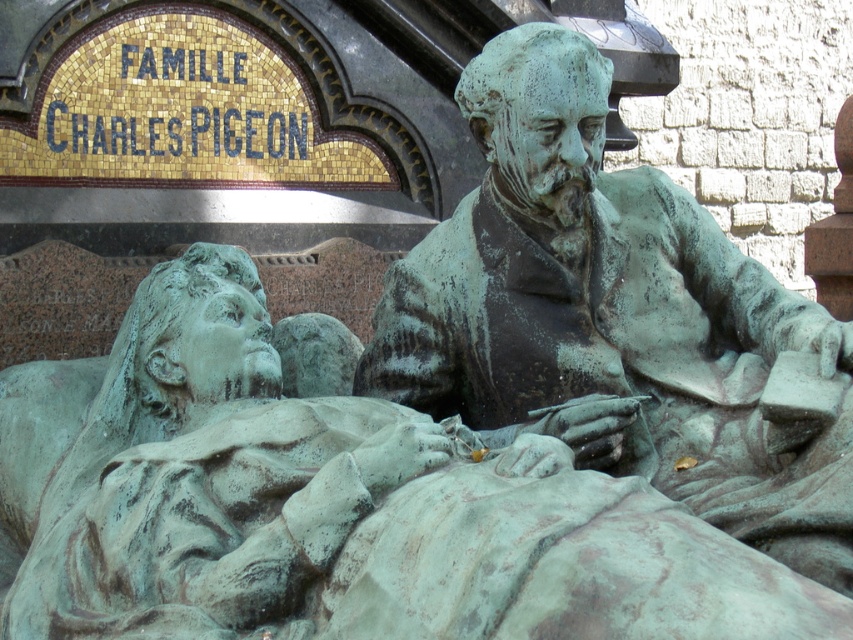
You are a tourist standing in front of the bronze sculpture. You notice a point marked at coordinates (329, 506). Based on the scene description, what object is located at that point?

The point at coordinates (329, 506) indicates the green patinated bronze statue at upper center.

You are an art conservator assessing the spacing between two green patinated bronze statues in the memorial. The statues are labeled as the green patinated bronze statue at upper center and the green patinated bronze statue at center. Given that the statues must be spaced at least 2 meters apart for preservation purposes, can you determine if the current spacing meets this requirement based on their widths?

The green patinated bronze statue at upper center is wider than the green patinated bronze statue at center. However, the exact spacing between them isn